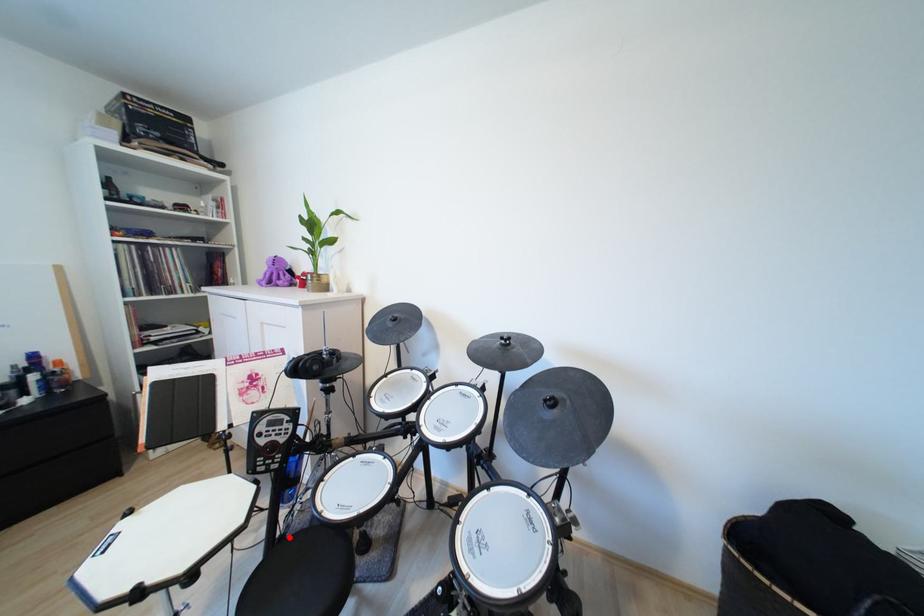
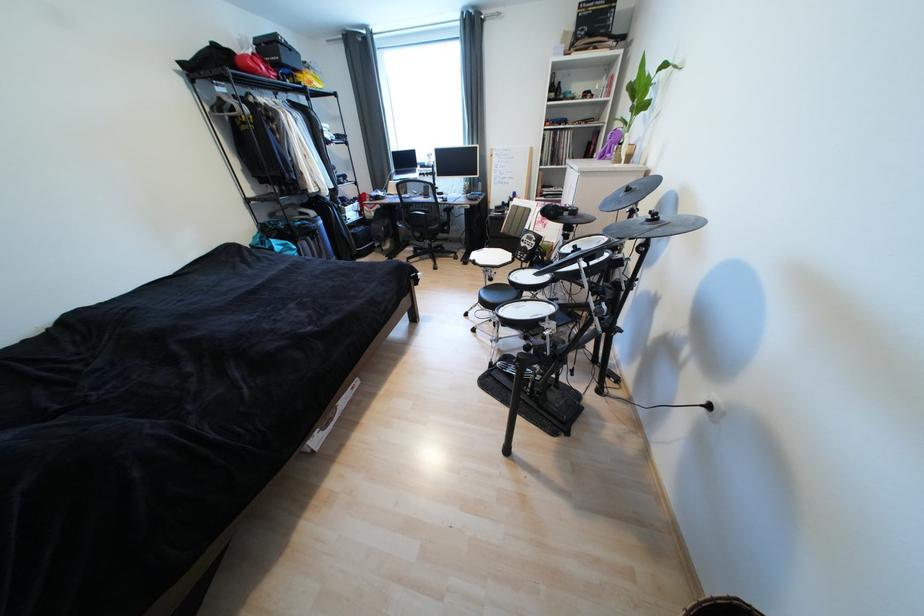
Question: I am providing you with two images of the same scene from different viewpoints. A red point is marked on the first image. Can you still see the location of the red point in image 2?

Choices:
 (A) Yes
 (B) No

Answer: (B)